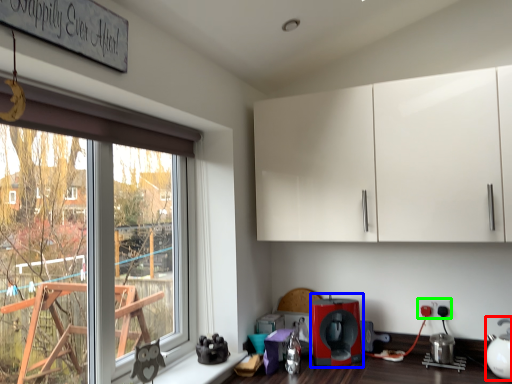
Question: Which object is the closest to the tea pot (highlighted by a red box)? Choose among these: coffee machine (highlighted by a blue box) or electric outlet (highlighted by a green box).

Choices:
 (A) coffee machine
 (B) electric outlet

Answer: (B)